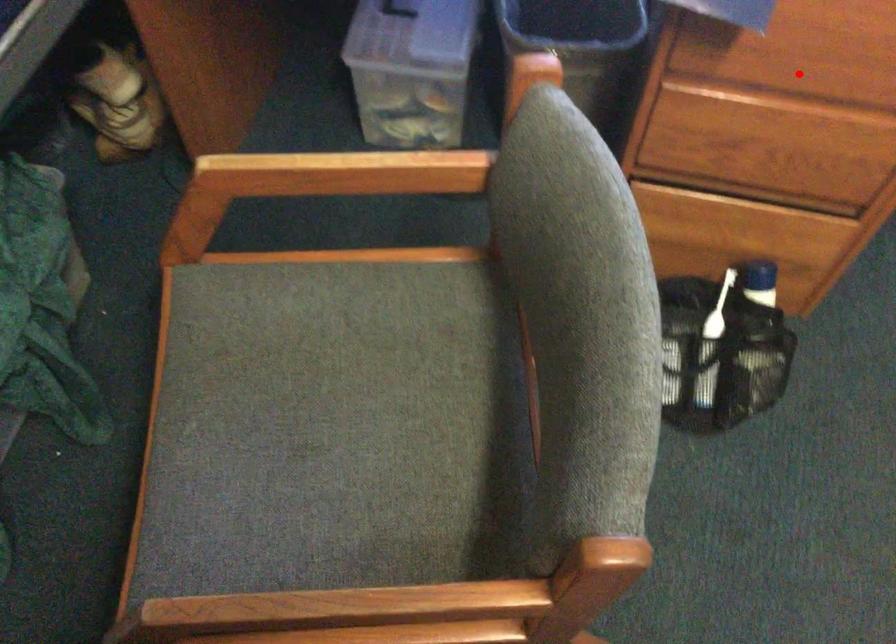
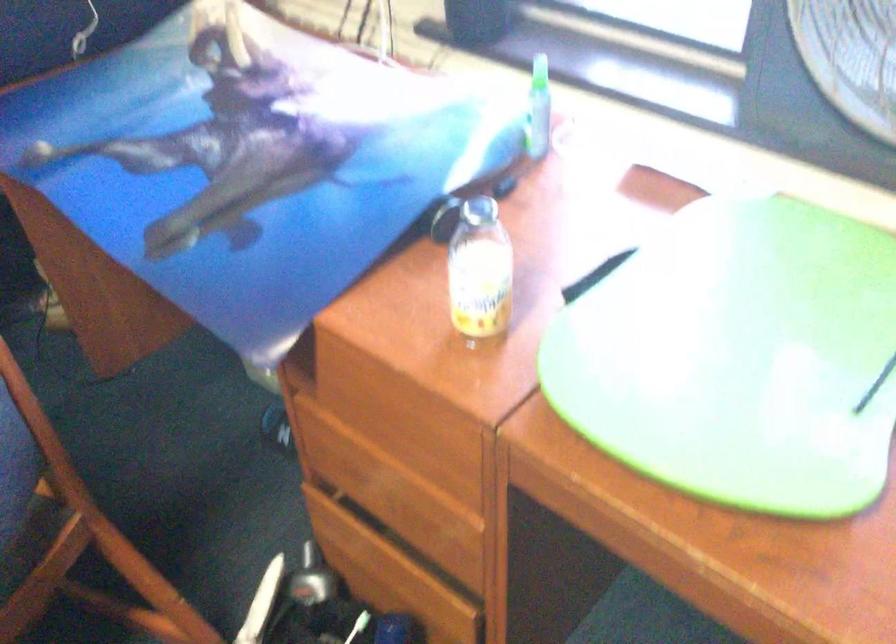
Question: I am providing you with two images of the same scene from different viewpoints. A red point is marked on the first image. Can you still see the location of the red point in image 2?

Choices:
 (A) Yes
 (B) No

Answer: (A)